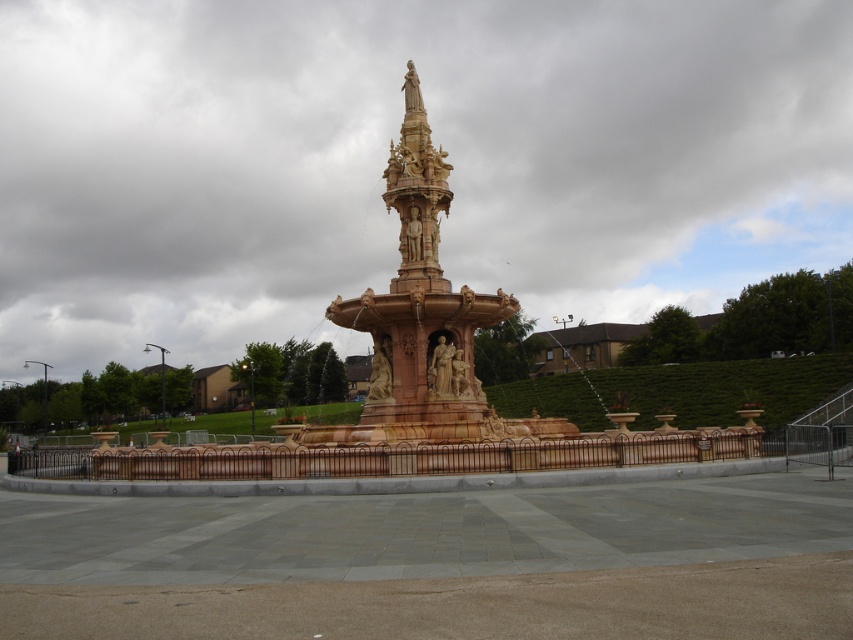
Can you confirm if polished stone fountain at center is shorter than golden stone spire at center?

In fact, polished stone fountain at center may be taller than golden stone spire at center.

Is polished stone fountain at center to the right of golden stone spire at center from the viewer's perspective?

Incorrect, polished stone fountain at center is not on the right side of golden stone spire at center.

Is point (401, 289) in front of point (442, 156)?

That is True.

This screenshot has width=853, height=640. Identify the location of polished stone fountain at center. (403, 380).